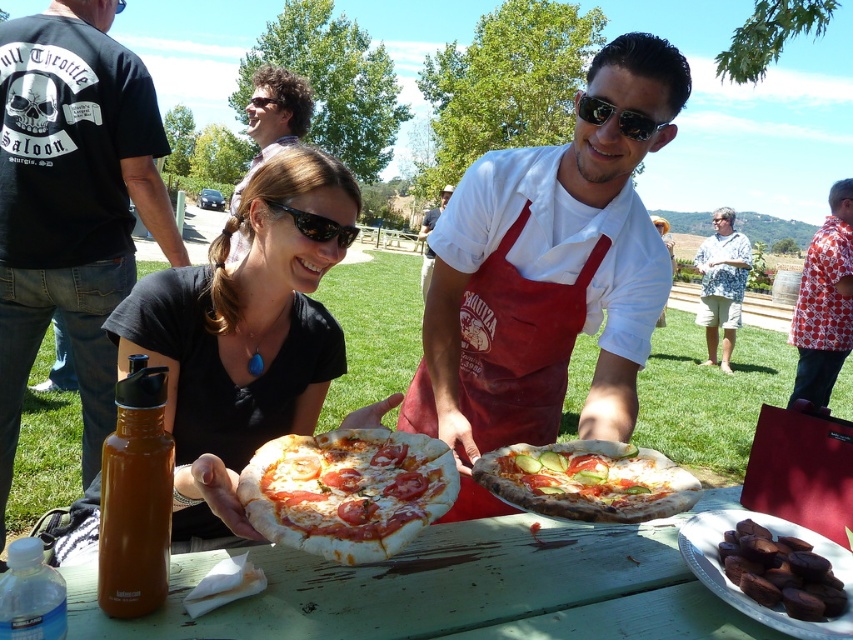
Does matte white shirt at center come behind dark chocolate at lower right?

No.

In order to click on matte white shirt at center in this screenshot , I will do `click(548, 273)`.

Where is `matte white shirt at center`? The image size is (853, 640). matte white shirt at center is located at coordinates (548, 273).

Does matte white shirt at center have a lesser height compared to matte black shirt at center?

No, matte white shirt at center is not shorter than matte black shirt at center.

Who is positioned more to the right, matte white shirt at center or matte black shirt at center?

From the viewer's perspective, matte white shirt at center appears more on the right side.

You are a GUI agent. You are given a task and a screenshot of the screen. Output one action in this format:
    pyautogui.click(x=<x>, y=<y>)
    Task: Click on the matte white shirt at center
    
    Given the screenshot: What is the action you would take?
    pyautogui.click(x=548, y=273)

Find the location of `red patterned shirt at center`. red patterned shirt at center is located at coordinates (824, 301).

Between red patterned shirt at center and sunglasses at center, which one appears on the right side from the viewer's perspective?

red patterned shirt at center

Which is behind, point (815, 246) or point (633, 138)?

Point (815, 246)

Find the location of a particular element. red patterned shirt at center is located at coordinates (824, 301).